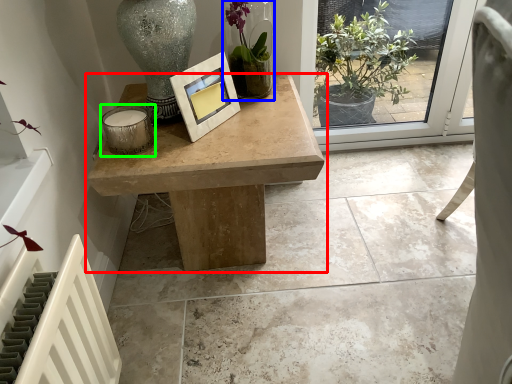
Question: Which object is positioned farthest from table (highlighted by a red box)? Select from houseplant (highlighted by a blue box) and candle holder (highlighted by a green box).

Choices:
 (A) houseplant
 (B) candle holder

Answer: (A)